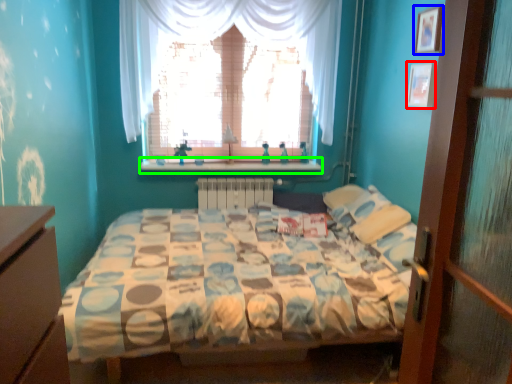
Question: Which is nearer to the picture frame (highlighted by a red box)? picture frame (highlighted by a blue box) or window sill (highlighted by a green box).

Choices:
 (A) picture frame
 (B) window sill

Answer: (A)